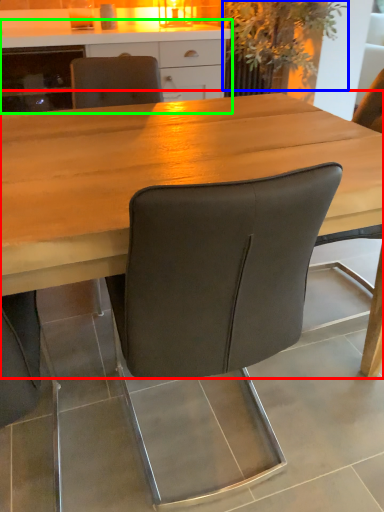
Question: Which object is the farthest from table (highlighted by a red box)? Choose among these: plant (highlighted by a blue box) or cabinetry (highlighted by a green box).

Choices:
 (A) plant
 (B) cabinetry

Answer: (A)